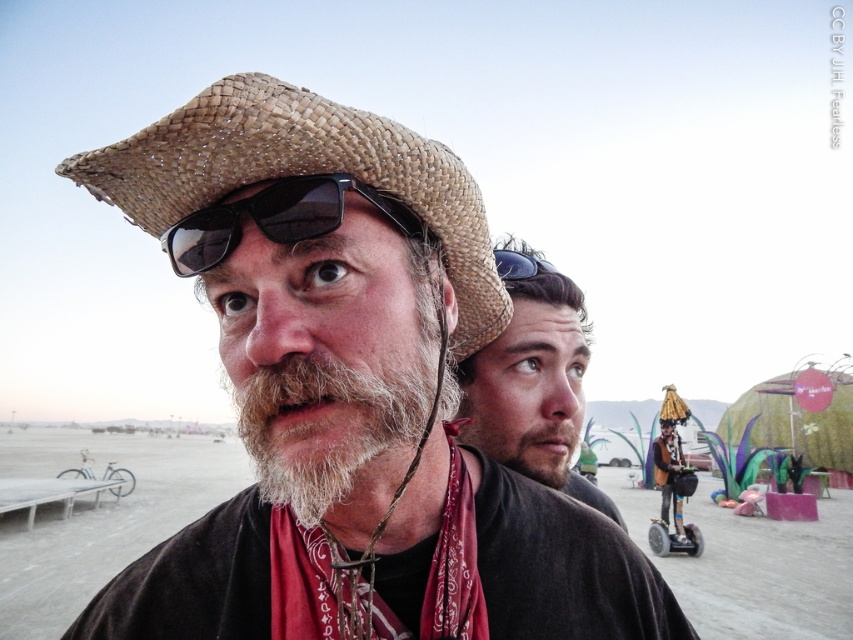
Question: Can you confirm if graywoollybeard at center is thinner than beige straw hat at center?

Choices:
 (A) no
 (B) yes

Answer: (B)

Question: Where is red bandana at center located in relation to black matte goggles at upper center in the image?

Choices:
 (A) below
 (B) above

Answer: (A)

Question: Which object is the closest to the black matte goggles at upper center?

Choices:
 (A) beige straw hat at center
 (B) red bandana at center

Answer: (A)

Question: Estimate the real-world distances between objects in this image. Which object is farther from the red bandana at center?

Choices:
 (A) woven straw cowboy hat at center
 (B) black matte goggles at upper center
 (C) beige straw hat at center

Answer: (B)

Question: Among these objects, which one is nearest to the camera?

Choices:
 (A) black matte sunglasses at upper center
 (B) graywoollybeard at center

Answer: (B)

Question: Is graywoollybeard at center smaller than woven straw cowboy hat at center?

Choices:
 (A) yes
 (B) no

Answer: (A)